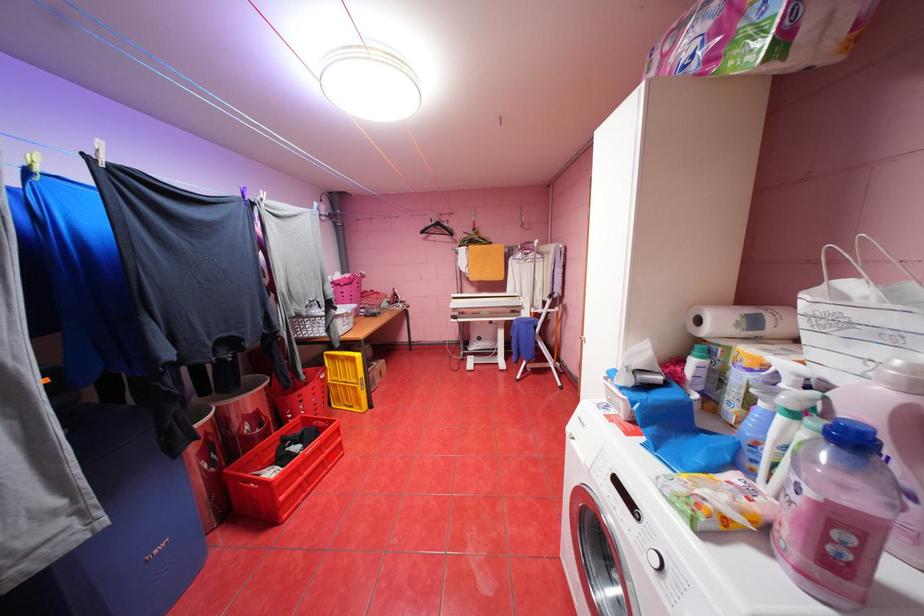
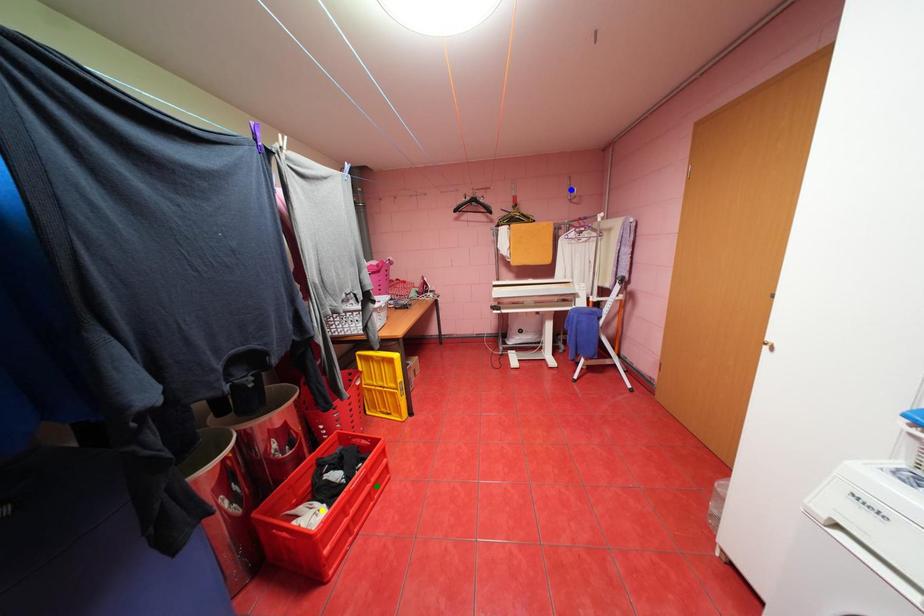
Question: I am providing you with two images of the same scene from different viewpoints. A red point is marked on the first image. You are given multiple points on the second image. Which point in image 2 is actually the same real-world point as the red point in image 1?

Choices:
 (A) blue point
 (B) yellow point
 (C) green point

Answer: (C)